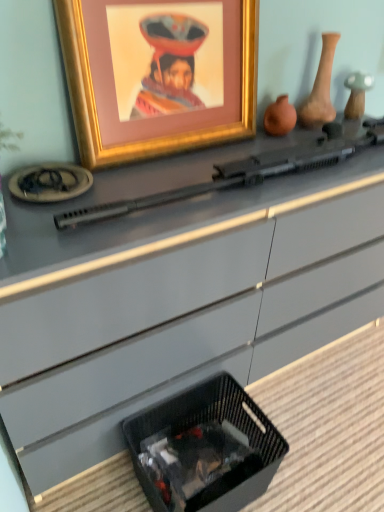
Identify the location of vacant area that lies in front of matte clay vase at upper center, which is the second vase in right-to-left order. This screenshot has width=384, height=512. click(x=280, y=148).